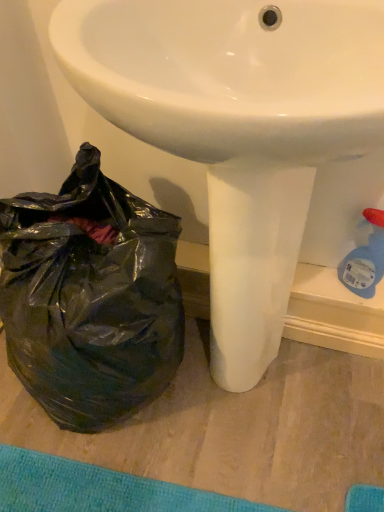
Image resolution: width=384 pixels, height=512 pixels. In order to click on black plastic bag at lower left in this screenshot , I will do `click(90, 297)`.

The width and height of the screenshot is (384, 512). Describe the element at coordinates (90, 297) in the screenshot. I see `black plastic bag at lower left` at that location.

What do you see at coordinates (240, 130) in the screenshot? The height and width of the screenshot is (512, 384). I see `white glossy sink at center` at bounding box center [240, 130].

Where is `white glossy sink at center`? This screenshot has width=384, height=512. white glossy sink at center is located at coordinates (240, 130).

Find the location of a particular element. This screenshot has height=512, width=384. black plastic bag at lower left is located at coordinates (90, 297).

Which object is positioned more to the right, black plastic bag at lower left or white glossy sink at center?

white glossy sink at center is more to the right.

Does black plastic bag at lower left lie in front of white glossy sink at center?

No, black plastic bag at lower left is behind white glossy sink at center.

Which point is more distant from viewer, (x=87, y=264) or (x=214, y=91)?

The point (x=87, y=264) is farther from the camera.

Based on the photo, from the image's perspective, is black plastic bag at lower left above white glossy sink at center?

No.

From a real-world perspective, is black plastic bag at lower left over white glossy sink at center?

No.

In terms of width, does black plastic bag at lower left look wider or thinner when compared to white glossy sink at center?

Clearly, black plastic bag at lower left has less width compared to white glossy sink at center.

Based on the photo, is black plastic bag at lower left taller or shorter than white glossy sink at center?

Considering their sizes, black plastic bag at lower left has less height than white glossy sink at center.

Considering the relative sizes of black plastic bag at lower left and white glossy sink at center in the image provided, is black plastic bag at lower left smaller than white glossy sink at center?

Correct, black plastic bag at lower left occupies less space than white glossy sink at center.

Is black plastic bag at lower left situated inside white glossy sink at center or outside?

black plastic bag at lower left exists entirely within white glossy sink at center.

Is black plastic bag at lower left positioned far away from white glossy sink at center?

They are positioned close to each other.

Is black plastic bag at lower left positioned with its back to white glossy sink at center?

black plastic bag at lower left does not have its back to white glossy sink at center.

How different are the orientations of black plastic bag at lower left and white glossy sink at center in degrees?

1.5 degrees separate the facing orientations of black plastic bag at lower left and white glossy sink at center.

How distant is black plastic bag at lower left from white glossy sink at center?

black plastic bag at lower left and white glossy sink at center are 11.87 inches apart from each other.

Find the location of `sink above the black plastic bag at lower left (from a real-world perspective)`. sink above the black plastic bag at lower left (from a real-world perspective) is located at coordinates (240, 130).

Is white glossy sink at center at the right side of black plastic bag at lower left?

Yes, white glossy sink at center is to the right of black plastic bag at lower left.

Is white glossy sink at center in front of or behind black plastic bag at lower left in the image?

Clearly, white glossy sink at center is in front of black plastic bag at lower left.

Considering the points (290, 258) and (145, 375), which point is in front, point (290, 258) or point (145, 375)?

The point (290, 258) is more forward.

From the image's perspective, between white glossy sink at center and black plastic bag at lower left, who is located below?

black plastic bag at lower left appears lower in the image.

From a real-world perspective, is white glossy sink at center positioned over black plastic bag at lower left based on gravity?

Yes, from a real-world perspective, white glossy sink at center is above black plastic bag at lower left.

Does white glossy sink at center have a greater width compared to black plastic bag at lower left?

Correct, the width of white glossy sink at center exceeds that of black plastic bag at lower left.

Does white glossy sink at center have a greater height compared to black plastic bag at lower left?

Indeed, white glossy sink at center has a greater height compared to black plastic bag at lower left.

Can you confirm if white glossy sink at center is smaller than black plastic bag at lower left?

Actually, white glossy sink at center might be larger than black plastic bag at lower left.

Is white glossy sink at center not within black plastic bag at lower left?

Yes, white glossy sink at center is located beyond the bounds of black plastic bag at lower left.

Is white glossy sink at center directly adjacent to black plastic bag at lower left?

white glossy sink at center and black plastic bag at lower left are not in contact.

Is white glossy sink at center facing towards black plastic bag at lower left?

No, white glossy sink at center is not turned towards black plastic bag at lower left.

The width and height of the screenshot is (384, 512). In order to click on plastic bag directly beneath the white glossy sink at center (from a real-world perspective) in this screenshot , I will do `click(90, 297)`.

Find the location of a particular element. sink on the right of black plastic bag at lower left is located at coordinates (240, 130).

The height and width of the screenshot is (512, 384). I want to click on sink that is in front of the black plastic bag at lower left, so click(240, 130).